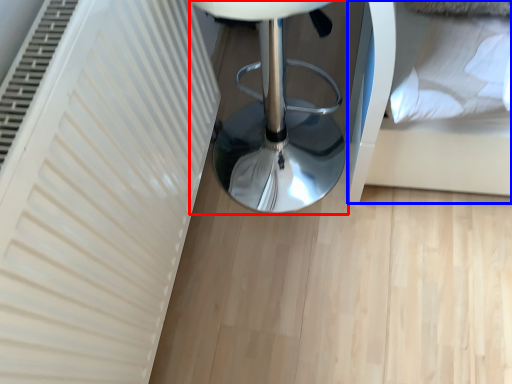
Question: Among these objects, which one is nearest to the camera, furniture (highlighted by a red box) or bed (highlighted by a blue box)?

Choices:
 (A) furniture
 (B) bed

Answer: (A)